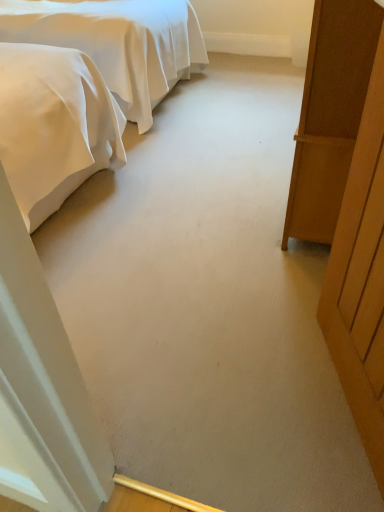
Question: Considering the relative sizes of wooden door at right and satin white bed at upper left in the image provided, is wooden door at right thinner than satin white bed at upper left?

Choices:
 (A) yes
 (B) no

Answer: (A)

Question: Is wooden door at right beside satin white bed at upper left?

Choices:
 (A) yes
 (B) no

Answer: (B)

Question: Is wooden door at right far from satin white bed at upper left?

Choices:
 (A) no
 (B) yes

Answer: (B)

Question: Can you confirm if wooden door at right is smaller than satin white bed at upper left?

Choices:
 (A) yes
 (B) no

Answer: (A)

Question: Considering the relative positions of wooden door at right and satin white bed at upper left in the image provided, is wooden door at right in front of satin white bed at upper left?

Choices:
 (A) yes
 (B) no

Answer: (A)

Question: From the image's perspective, is satin white bed at upper left positioned above or below wooden door at right?

Choices:
 (A) below
 (B) above

Answer: (B)

Question: Is satin white bed at upper left bigger or smaller than wooden door at right?

Choices:
 (A) small
 (B) big

Answer: (B)

Question: Do you think satin white bed at upper left is within wooden door at right, or outside of it?

Choices:
 (A) inside
 (B) outside

Answer: (B)

Question: In the image, is satin white bed at upper left positioned in front of or behind wooden door at right?

Choices:
 (A) front
 (B) behind

Answer: (B)

Question: Is wooden wardrobe at right to the left or to the right of wooden door at right in the image?

Choices:
 (A) left
 (B) right

Answer: (B)

Question: Is point (322, 173) closer or farther from the camera than point (357, 231)?

Choices:
 (A) closer
 (B) farther

Answer: (B)

Question: Looking at their shapes, would you say wooden wardrobe at right is wider or thinner than wooden door at right?

Choices:
 (A) wide
 (B) thin

Answer: (A)

Question: From a real-world perspective, relative to wooden door at right, is wooden wardrobe at right vertically above or below?

Choices:
 (A) above
 (B) below

Answer: (B)

Question: From the image's perspective, relative to wooden wardrobe at right, is wooden door at right above or below?

Choices:
 (A) above
 (B) below

Answer: (B)

Question: Looking at their shapes, would you say wooden door at right is wider or thinner than wooden wardrobe at right?

Choices:
 (A) thin
 (B) wide

Answer: (A)